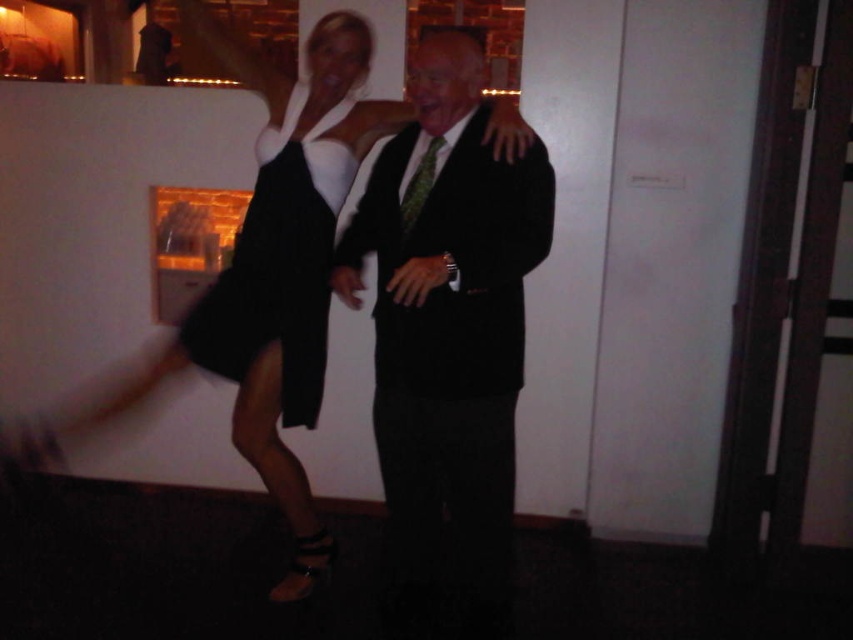
Question: Is black matte suit at center above black matte dress at center?

Choices:
 (A) yes
 (B) no

Answer: (B)

Question: Estimate the real-world distances between objects in this image. Which object is farther from the black satin dress at center?

Choices:
 (A) black matte dress at center
 (B) black matte suit at center

Answer: (B)

Question: Can you confirm if black matte suit at center is positioned above green textured tie at center?

Choices:
 (A) yes
 (B) no

Answer: (B)

Question: Which object appears farthest from the camera in this image?

Choices:
 (A) green textured tie at center
 (B) black matte suit at center

Answer: (A)

Question: Can you confirm if black matte suit at center is thinner than green textured tie at center?

Choices:
 (A) yes
 (B) no

Answer: (B)

Question: Which object is positioned farthest from the black matte suit at center?

Choices:
 (A) black satin dress at center
 (B) green textured tie at center
 (C) black matte dress at center

Answer: (A)